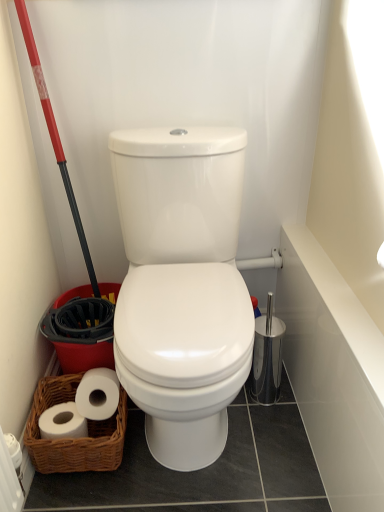
In order to face red plastic shovel at left, should I rotate leftwards or rightwards?

To face it directly, rotate left by 16.519 degrees.

What is the approximate width of white glossy bath at upper right?

white glossy bath at upper right is 3.17 inches in width.

This screenshot has height=512, width=384. Find the location of `woven brown basket at lower left`. woven brown basket at lower left is located at coordinates (74, 439).

Is woven brown basket at lower left oriented away from white glossy bath at upper right?

No, woven brown basket at lower left's orientation is not away from white glossy bath at upper right.

Is white glossy bath at upper right a part of woven brown basket at lower left?

No, white glossy bath at upper right is located outside of woven brown basket at lower left.

Can you tell me how much woven brown basket at lower left and white glossy bath at upper right differ in facing direction?

The facing directions of woven brown basket at lower left and white glossy bath at upper right are 90.6 degrees apart.

Would you consider woven brown basket at lower left to be distant from red plastic shovel at left?

No, woven brown basket at lower left is not far from red plastic shovel at left.

Which object is positioned more to the right, woven brown basket at lower left or red plastic shovel at left?

From the viewer's perspective, woven brown basket at lower left appears more on the right side.

Does woven brown basket at lower left contain red plastic shovel at left?

Actually, red plastic shovel at left is outside woven brown basket at lower left.

Which point is more distant from viewer, (29, 421) or (56, 126)?

The point (56, 126) is behind.

From the image's perspective, which one is positioned lower, white glossy bath at upper right or woven brown basket at lower left?

From the image's view, woven brown basket at lower left is below.

From a real-world perspective, which is physically above, white glossy bath at upper right or woven brown basket at lower left?

From a 3D spatial view, white glossy bath at upper right is above.

Which object is further away from the camera taking this photo, white glossy bath at upper right or woven brown basket at lower left?

woven brown basket at lower left.

From the image's perspective, is red plastic shovel at left on woven brown basket at lower left?

Yes, from the image's perspective, red plastic shovel at left is on top of woven brown basket at lower left.

Is red plastic shovel at left thinner than woven brown basket at lower left?

Yes, red plastic shovel at left is thinner than woven brown basket at lower left.

Consider the image. Measure the distance from red plastic shovel at left to woven brown basket at lower left.

red plastic shovel at left is 13.11 inches away from woven brown basket at lower left.

Is red plastic shovel at left oriented towards woven brown basket at lower left?

Yes, red plastic shovel at left is facing woven brown basket at lower left.

From a real-world perspective, which object stands above the other?

In real-world perspective, red plastic shovel at left is above.

Considering the sizes of objects red plastic shovel at left and white glossy bath at upper right in the image provided, who is thinner, red plastic shovel at left or white glossy bath at upper right?

white glossy bath at upper right is thinner.

Considering the sizes of red plastic shovel at left and white glossy bath at upper right in the image, is red plastic shovel at left taller or shorter than white glossy bath at upper right?

In the image, red plastic shovel at left appears to be taller than white glossy bath at upper right.

Is white glossy bath at upper right surrounded by red plastic shovel at left?

No, white glossy bath at upper right is not inside red plastic shovel at left.

Considering the sizes of objects white glossy bath at upper right and red plastic shovel at left in the image provided, who is wider, white glossy bath at upper right or red plastic shovel at left?

With larger width is red plastic shovel at left.

You are a GUI agent. You are given a task and a screenshot of the screen. Output one action in this format:
    pyautogui.click(x=<x>, y=<y>)
    Task: Click on the bath in front of the red plastic shovel at left
    
    Given the screenshot: What is the action you would take?
    pyautogui.click(x=333, y=372)

Is white glossy bath at upper right positioned far away from red plastic shovel at left?

No, white glossy bath at upper right is not far away from red plastic shovel at left.

Locate an element on the screen. The image size is (384, 512). bath lying on the right of woven brown basket at lower left is located at coordinates (333, 372).

This screenshot has width=384, height=512. Identify the location of basket below the red plastic shovel at left (from the image's perspective). (74, 439).

Based on their spatial positions, is red plastic shovel at left or woven brown basket at lower left closer to white glossy bath at upper right?

woven brown basket at lower left is closer to white glossy bath at upper right.

Considering their positions, is white glossy bath at upper right positioned closer to red plastic shovel at left than woven brown basket at lower left?

woven brown basket at lower left is closer to red plastic shovel at left.

Based on their spatial positions, is woven brown basket at lower left or red plastic shovel at left further from white glossy bath at upper right?

red plastic shovel at left is further to white glossy bath at upper right.

Estimate the real-world distances between objects in this image. Which object is closer to woven brown basket at lower left, white glossy bath at upper right or red plastic shovel at left?

red plastic shovel at left is positioned closer to the anchor woven brown basket at lower left.

Which object lies further to the anchor point red plastic shovel at left, woven brown basket at lower left or white glossy bath at upper right?

white glossy bath at upper right.

Estimate the real-world distances between objects in this image. Which object is closer to woven brown basket at lower left, red plastic shovel at left or white glossy bath at upper right?

red plastic shovel at left.

This screenshot has height=512, width=384. What are the coordinates of `basket between red plastic shovel at left and white glossy bath at upper right from left to right` in the screenshot? It's located at (74, 439).